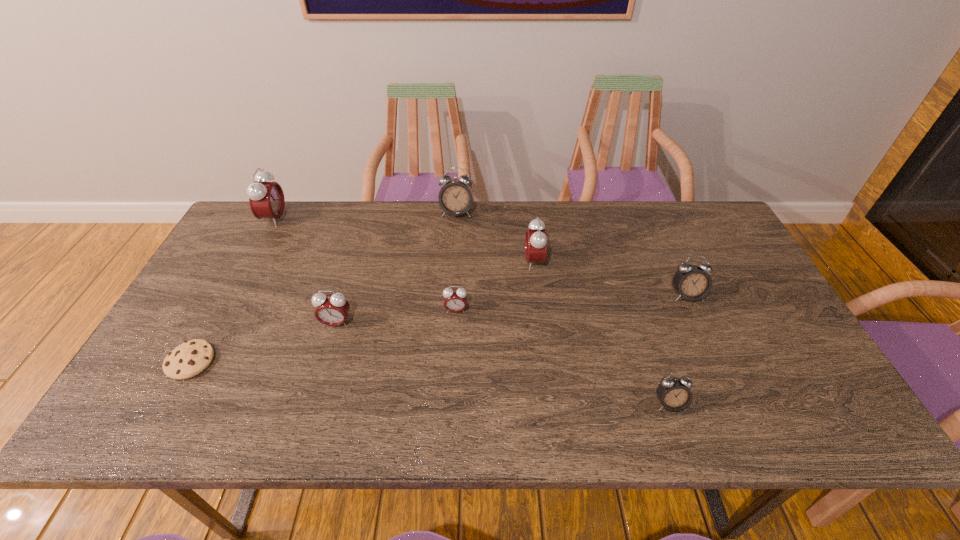
Where is `the third nearest alarm clock`? The height and width of the screenshot is (540, 960). the third nearest alarm clock is located at coordinates (455, 300).

Locate an element on the screen. the second nearest pink alarm clock is located at coordinates (455, 300).

Where is `the smallest white alarm clock`? the smallest white alarm clock is located at coordinates (x=674, y=394).

This screenshot has height=540, width=960. What are the coordinates of `the nearest white alarm clock` in the screenshot? It's located at (674, 394).

This screenshot has width=960, height=540. Identify the location of brown cookie. (192, 357).

Image resolution: width=960 pixels, height=540 pixels. What are the coordinates of `the second nearest object` in the screenshot? It's located at (192, 357).

Image resolution: width=960 pixels, height=540 pixels. Identify the location of vacant area situated 0.140m on the clock face of the farthest pink alarm clock. (327, 219).

At what (x,y) coordinates should I click in order to perform the action: click on vacant area located 0.050m on the face of the farthest white alarm clock. Please return your answer as a coordinate pair (x, y). The image size is (960, 540). Looking at the image, I should click on (455, 231).

The width and height of the screenshot is (960, 540). What are the coordinates of `free space located 0.270m on the clock face of the rightmost pink alarm clock` in the screenshot? It's located at (435, 262).

This screenshot has height=540, width=960. What are the coordinates of `free space located 0.390m on the clock face of the rightmost pink alarm clock` in the screenshot? It's located at (395, 262).